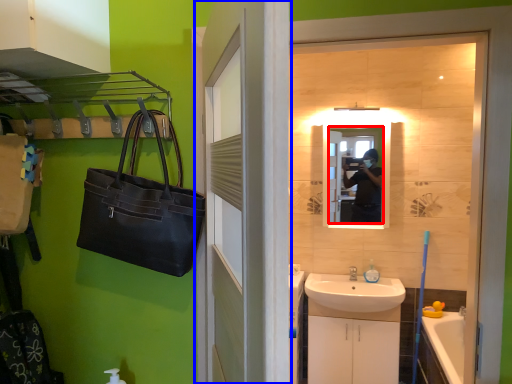
Question: Which object is closer to the camera taking this photo, mirror (highlighted by a red box) or door (highlighted by a blue box)?

Choices:
 (A) mirror
 (B) door

Answer: (B)